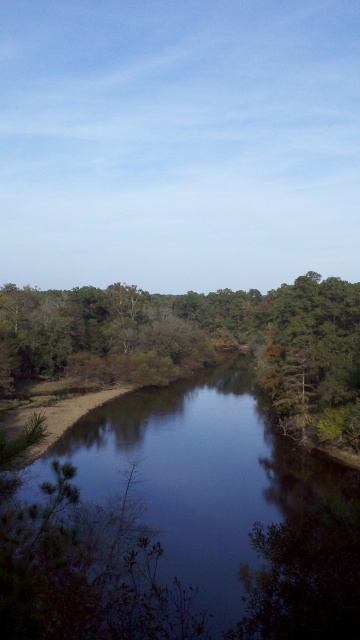
Which is more to the left, dark reflective water at center or green leafy tree at center?

Positioned to the left is green leafy tree at center.

Does point (264, 508) come in front of point (77, 342)?

Yes, it is in front of point (77, 342).

Image resolution: width=360 pixels, height=640 pixels. In order to click on dark reflective water at center in this screenshot , I will do `click(172, 516)`.